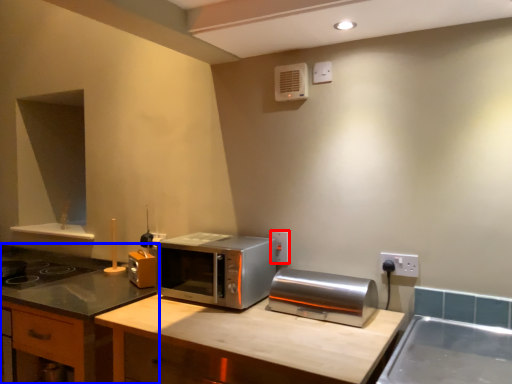
Question: Among these objects, which one is farthest to the camera, electric outlet (highlighted by a red box) or cabinetry (highlighted by a blue box)?

Choices:
 (A) electric outlet
 (B) cabinetry

Answer: (A)